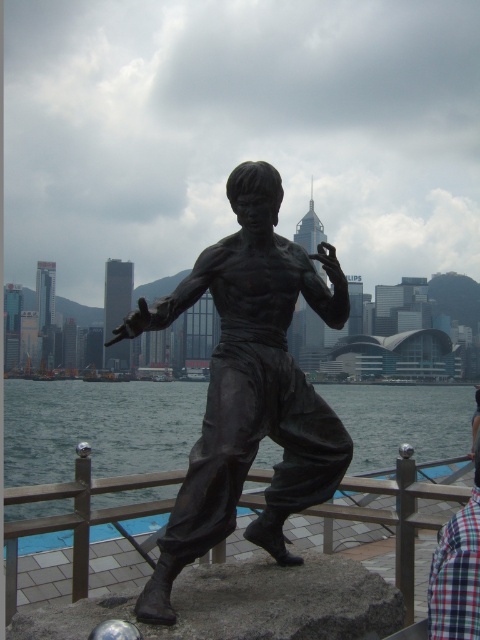
Question: Is brown wooden rail at lower center bigger than plaid fabric shirt at lower right?

Choices:
 (A) no
 (B) yes

Answer: (B)

Question: Considering the real-world distances, which object is farthest from the brown wooden rail at lower center?

Choices:
 (A) black matte water at lower center
 (B) plaid fabric shirt at lower right
 (C) bronze statue at center

Answer: (A)

Question: Can you confirm if bronze statue at center is positioned above black matte water at lower center?

Choices:
 (A) no
 (B) yes

Answer: (B)

Question: Which of the following is the farthest from the observer?

Choices:
 (A) bronze statue at center
 (B) black matte water at lower center
 (C) brown wooden rail at lower center

Answer: (B)

Question: Among these points, which one is farthest from the camera?

Choices:
 (A) (455, 616)
 (B) (220, 493)

Answer: (B)

Question: From the image, what is the correct spatial relationship of bronze statue at center in relation to plaid fabric shirt at lower right?

Choices:
 (A) left
 (B) right

Answer: (A)